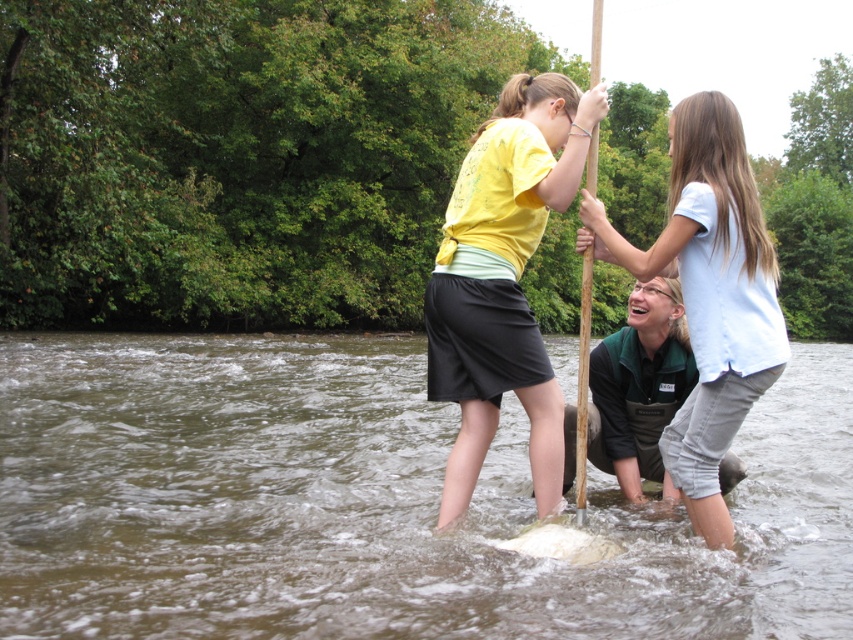
Can you confirm if brown muddy water at center is shorter than white cotton shirt at upper center?

In fact, brown muddy water at center may be taller than white cotton shirt at upper center.

Can you confirm if brown muddy water at center is positioned above white cotton shirt at upper center?

Incorrect, brown muddy water at center is not positioned above white cotton shirt at upper center.

Who is more distant from viewer, [758,561] or [769,253]?

Point [758,561]

What are the coordinates of `brown muddy water at center` in the screenshot? It's located at (373, 502).

Between point (160, 545) and point (525, 140), which one is positioned behind?

Positioned behind is point (160, 545).

Where is `brown muddy water at center`? brown muddy water at center is located at coordinates (373, 502).

Measure the distance between point (x=523, y=572) and camera.

Point (x=523, y=572) is 3.85 meters from camera.

The height and width of the screenshot is (640, 853). Find the location of `brown muddy water at center`. brown muddy water at center is located at coordinates (373, 502).

Is brown muddy water at center further to the viewer compared to brown wood paddle at center?

That is False.

Which of these two, brown muddy water at center or brown wood paddle at center, stands shorter?

With less height is brown muddy water at center.

Measure the distance between point (355, 522) and camera.

Point (355, 522) is 5.08 meters from camera.

The height and width of the screenshot is (640, 853). What are the coordinates of `brown muddy water at center` in the screenshot? It's located at (373, 502).